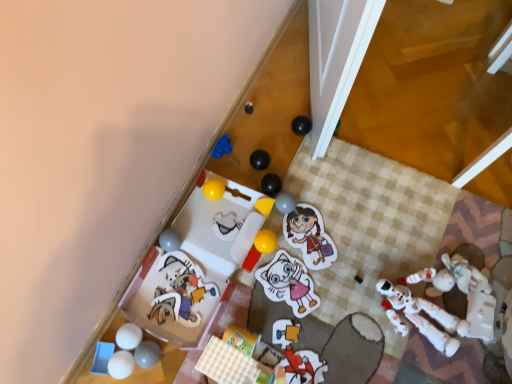
Find the location of a particular element. The width and height of the screenshot is (512, 384). vacant space to the left of cartoon cat plush at lower left, positioned as the 5th toy in left-to-right order is located at coordinates (128, 306).